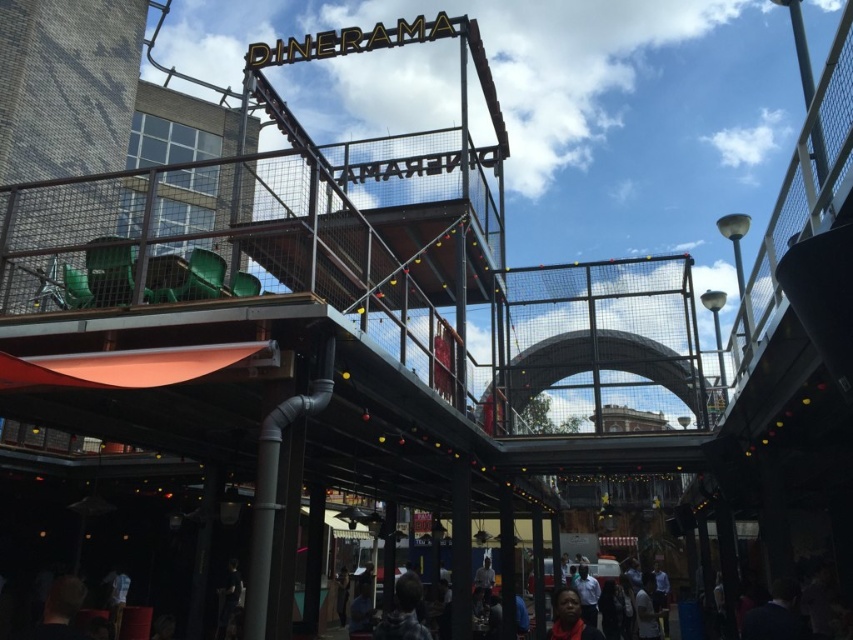
Does smooth skin face at lower center appear under white shirt at lower center?

No.

Is point (554, 632) farther from viewer compared to point (596, 598)?

That is False.

Identify the location of smooth skin face at lower center. (570, 618).

Consider the image. Is dark gray hoodie at lower center to the right of smooth skin face at lower center from the viewer's perspective?

In fact, dark gray hoodie at lower center is to the left of smooth skin face at lower center.

Can you confirm if dark gray hoodie at lower center is positioned below smooth skin face at lower center?

Yes.

Find the location of a particular element. The width and height of the screenshot is (853, 640). dark gray hoodie at lower center is located at coordinates (403, 612).

The width and height of the screenshot is (853, 640). I want to click on dark gray hoodie at lower center, so click(403, 612).

I want to click on dark gray hoodie at lower center, so click(403, 612).